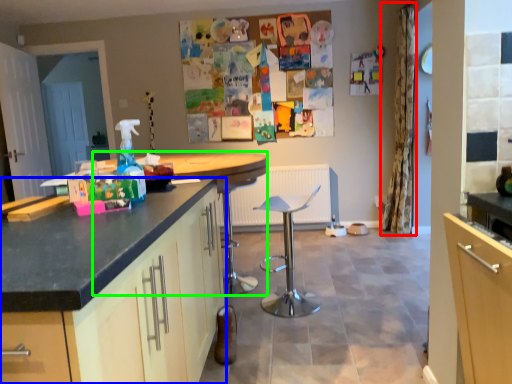
Question: Considering the real-world distances, which object is farthest from curtain (highlighted by a red box)? cabinetry (highlighted by a blue box) or round table (highlighted by a green box)?

Choices:
 (A) cabinetry
 (B) round table

Answer: (A)